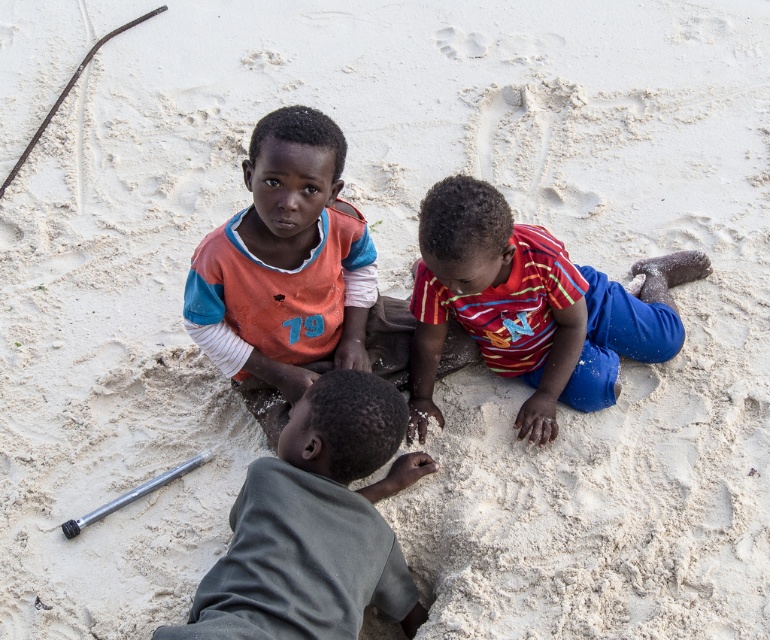
You are a photographer taking a picture of the beach scene. You notice two points marked in the image at coordinates point (243, 394) and point (385, 572). Which point is closer to your camera?

Point (243, 394) is further to the camera than point (385, 572), so the point closer to the camera is point (385, 572).

You are a photographer trying to capture a photo of the orange jersey at center and the dark gray cotton shirt at lower left. To ensure both are in the frame, should you adjust your camera to the left or right?

The orange jersey at center is to the right of the dark gray cotton shirt at lower left, so you should adjust your camera to the left to include both in the frame.

You are a photographer trying to capture a group photo of the orange jersey at center and the striped cotton shirt at center. Based on their positions, which one should you place on your left side in the photo to match the original scene?

The orange jersey at center should be placed on the left side in the photo to match the original scene since it is positioned on the left side of the striped cotton shirt at center.